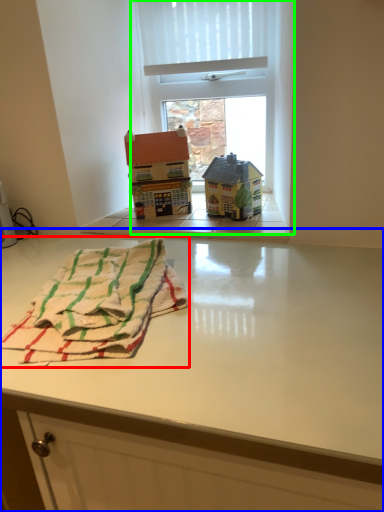
Question: Which is nearer to the beach towel (highlighted by a red box)? table (highlighted by a blue box) or window (highlighted by a green box).

Choices:
 (A) table
 (B) window

Answer: (A)